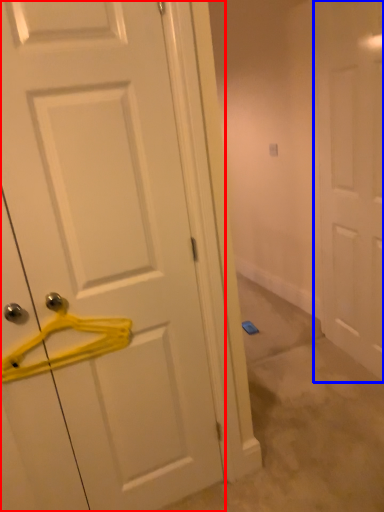
Question: Which object is closer to the camera taking this photo, door (highlighted by a red box) or door (highlighted by a blue box)?

Choices:
 (A) door
 (B) door

Answer: (A)